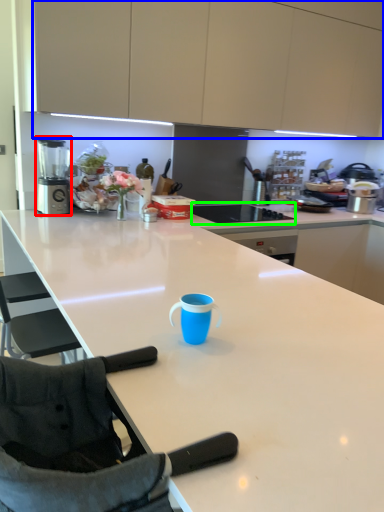
Question: Which is nearer to the blender (highlighted by a red box)? cabinetry (highlighted by a blue box) or home appliance (highlighted by a green box).

Choices:
 (A) cabinetry
 (B) home appliance

Answer: (A)